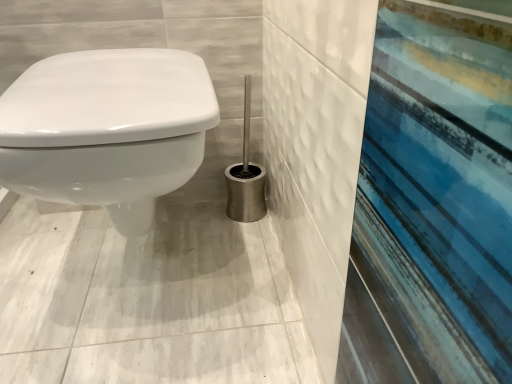
The height and width of the screenshot is (384, 512). Find the location of `free point to the left of satin silver toilet brush at center`. free point to the left of satin silver toilet brush at center is located at coordinates (190, 219).